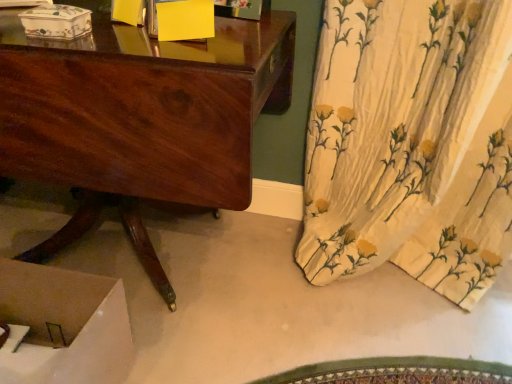
Question: Is yellow paper at upper center, placed as the 3th box when sorted from left to right, a part of yellow paper at upper center, which appears as the second box when viewed from the right?

Choices:
 (A) no
 (B) yes

Answer: (A)

Question: From a real-world perspective, is yellow paper at upper center, which appears as the second box when viewed from the right, located beneath yellow paper at upper center, which is counted as the first box, starting from the right?

Choices:
 (A) yes
 (B) no

Answer: (B)

Question: Is yellow paper at upper center, which appears as the second box when viewed from the right, in front of yellow paper at upper center, which is counted as the first box, starting from the right?

Choices:
 (A) no
 (B) yes

Answer: (A)

Question: Is yellow paper at upper center, which appears as the second box when viewed from the right, not near yellow paper at upper center, which is counted as the first box, starting from the right?

Choices:
 (A) yes
 (B) no

Answer: (B)

Question: Considering the relative positions of yellow paper at upper center, which appears as the second box when viewed from the right, and yellow paper at upper center, which is counted as the first box, starting from the right, in the image provided, is yellow paper at upper center, which appears as the second box when viewed from the right, to the right of yellow paper at upper center, which is counted as the first box, starting from the right, from the viewer's perspective?

Choices:
 (A) no
 (B) yes

Answer: (A)

Question: Considering the relative sizes of yellow paper at upper center, which appears as the second box when viewed from the right, and yellow paper at upper center, placed as the 3th box when sorted from left to right, in the image provided, is yellow paper at upper center, which appears as the second box when viewed from the right, bigger than yellow paper at upper center, placed as the 3th box when sorted from left to right,?

Choices:
 (A) yes
 (B) no

Answer: (B)

Question: Would you say porcelain floral box at upper left, the first box positioned from the left, is part of yellow paper at upper center, which appears as the second box when viewed from the right,'s contents?

Choices:
 (A) yes
 (B) no

Answer: (B)

Question: Is yellow paper at upper center, which appears as the second box when viewed from the right, shorter than porcelain floral box at upper left, which appears as the third box when viewed from the right?

Choices:
 (A) yes
 (B) no

Answer: (B)

Question: From the image's perspective, would you say yellow paper at upper center, the second box from the left, is positioned over porcelain floral box at upper left, which appears as the third box when viewed from the right?

Choices:
 (A) yes
 (B) no

Answer: (A)

Question: Is yellow paper at upper center, which appears as the second box when viewed from the right, positioned behind porcelain floral box at upper left, which appears as the third box when viewed from the right?

Choices:
 (A) no
 (B) yes

Answer: (B)

Question: Can you confirm if yellow paper at upper center, the second box from the left, is positioned to the left of porcelain floral box at upper left, which appears as the third box when viewed from the right?

Choices:
 (A) yes
 (B) no

Answer: (B)

Question: Is yellow paper at upper center, the second box from the left, facing towards porcelain floral box at upper left, the first box positioned from the left?

Choices:
 (A) no
 (B) yes

Answer: (B)

Question: Is porcelain floral box at upper left, the first box positioned from the left, oriented away from yellow paper at upper center, placed as the 3th box when sorted from left to right?

Choices:
 (A) yes
 (B) no

Answer: (B)